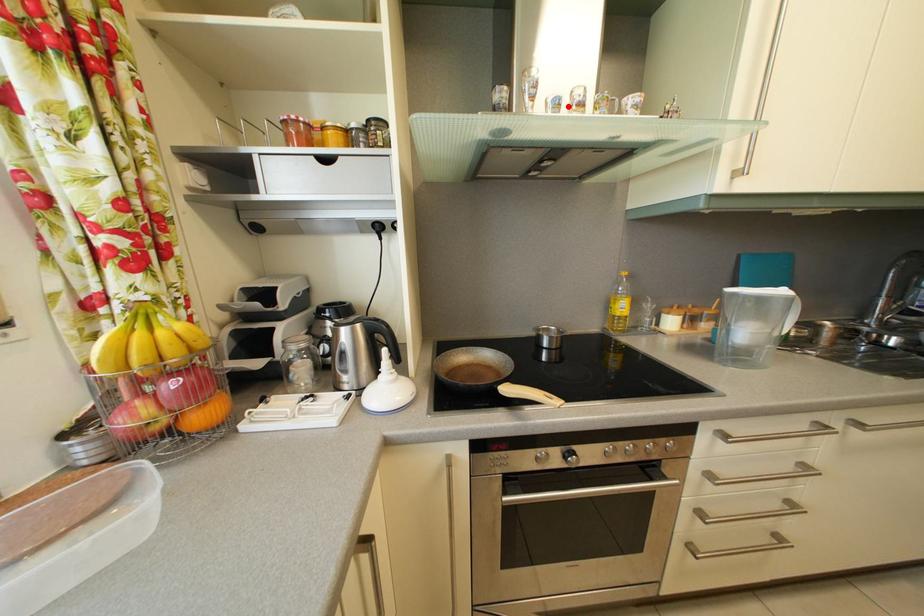
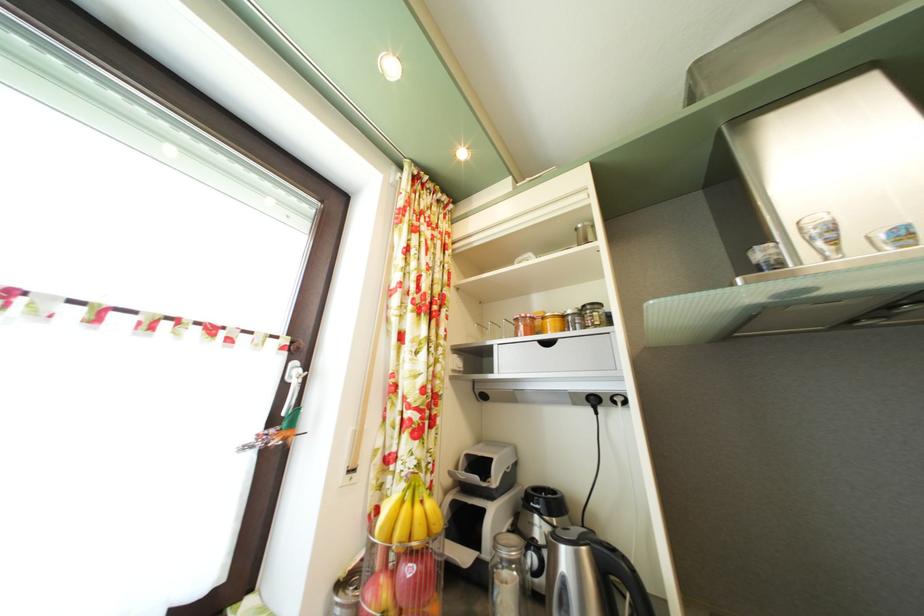
Locate, in the second image, the point that corresponds to the highlighted location in the first image.

(917, 235)